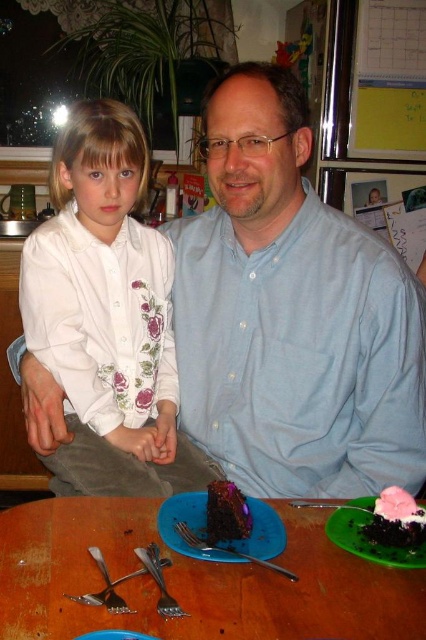
You are standing in the kitchen and see the white floral shirt at left. Where exactly is it located in terms of coordinates?

The white floral shirt at left is located at coordinates (106,364).

You are standing in the kitchen and want to reach the point at coordinates point (109, 129). Can you estimate how far you need to move forward to reach it?

The point (109, 129) is 3.56 feet from the viewer, so you need to move forward approximately 3.56 feet to reach it.

You are a chef preparing to serve dessert to two guests. You have two satin silver forks on the table. Where should you place each fork so that they are spaced appropriately for a formal dinner setting? Consider the distance between the satin silver fork at lower center and the satin silver fork at lower left.

The satin silver fork at lower center and the satin silver fork at lower left are currently 1.96 inches apart. In a formal dinner setting, forks should be spaced about 2 inches apart, so this distance is appropriate.